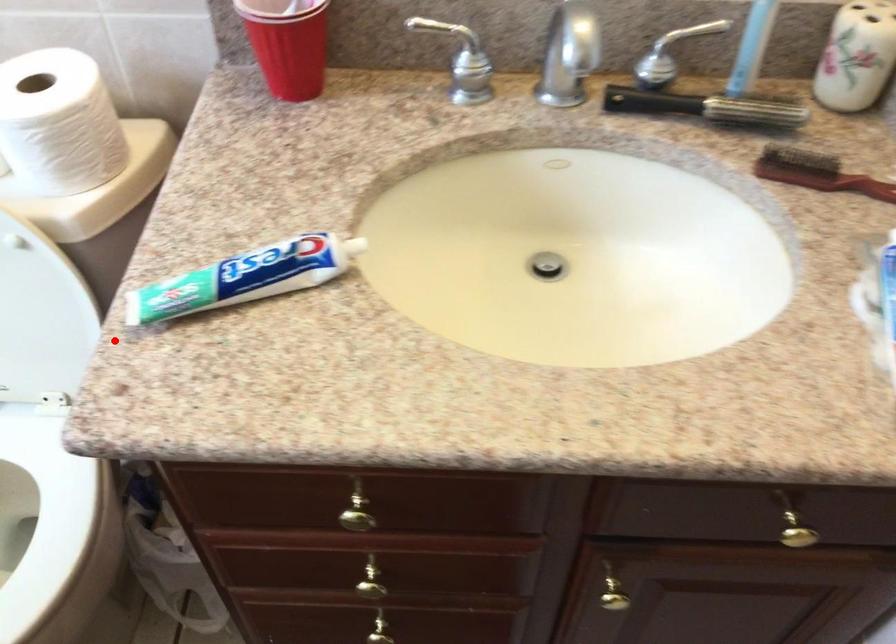
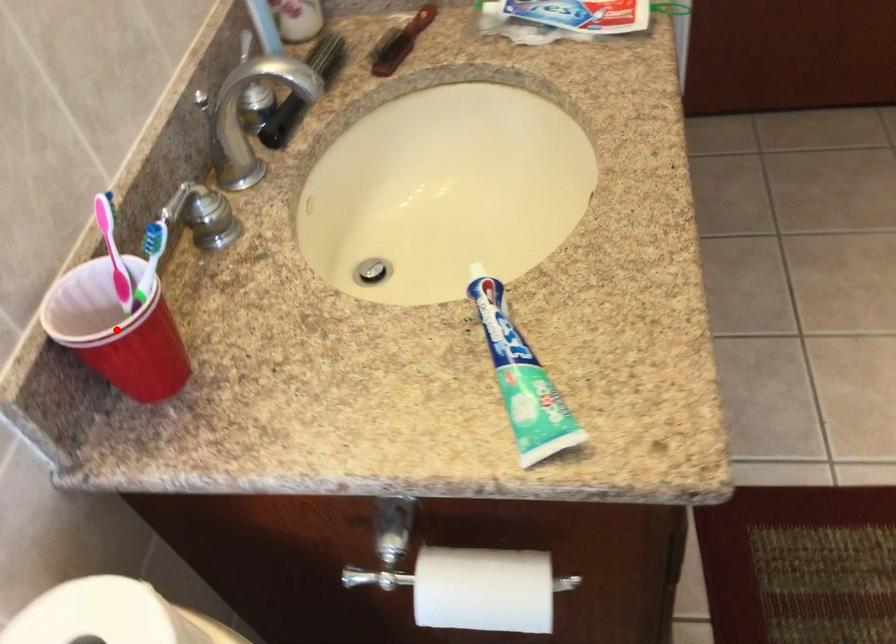
I am providing you with two images of the same scene from different viewpoints. A red point is marked on the first image and another point is marked on the second image. Is the marked point in image1 the same physical position as the marked point in image2?

No